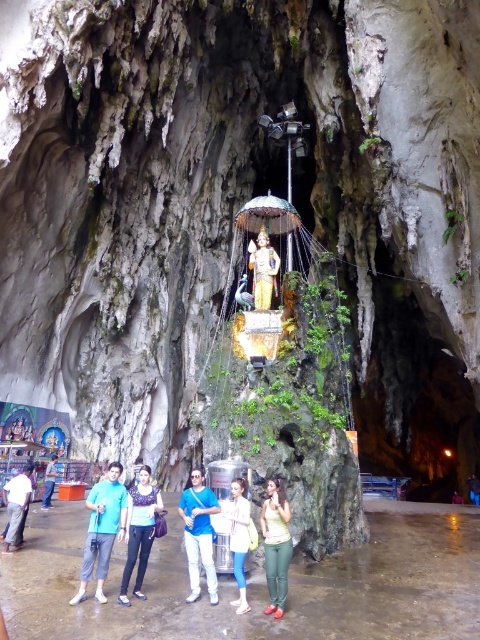
Which is below, green fabric pants at center or gold statue at center?

green fabric pants at center is lower down.

At what (x,y) coordinates should I click in order to perform the action: click on green fabric pants at center. Please return your answer as a coordinate pair (x, y). Image resolution: width=480 pixels, height=640 pixels. Looking at the image, I should click on (276, 545).

Can you confirm if blue cotton shirt at center is bigger than denim jeans at center?

No, blue cotton shirt at center is not bigger than denim jeans at center.

Is point (96, 524) farther from camera compared to point (148, 513)?

That is False.

Who is more distant from viewer, (x=82, y=563) or (x=141, y=547)?

The point (x=82, y=563) is behind.

The width and height of the screenshot is (480, 640). Find the location of `blue cotton shirt at center`. blue cotton shirt at center is located at coordinates (101, 529).

Is point (94, 499) closer to camera compared to point (194, 513)?

Yes, point (94, 499) is in front of point (194, 513).

From the picture: Which is below, blue cotton shirt at center or blue fabric shirt at center?

blue fabric shirt at center

Is point (119, 508) farther from camera compared to point (199, 484)?

No, it is not.

Find the location of `blue cotton shirt at center`. blue cotton shirt at center is located at coordinates (101, 529).